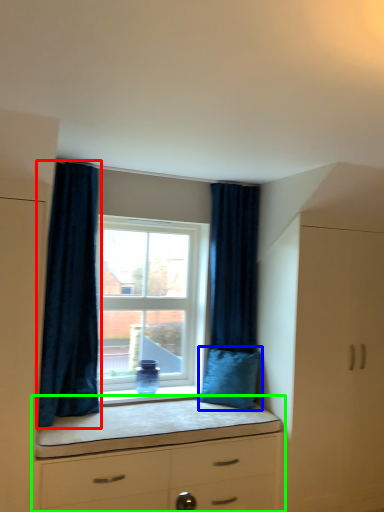
Question: Considering the real-world distances, which object is closest to curtain (highlighted by a red box)? pillow (highlighted by a blue box) or chest of drawers (highlighted by a green box).

Choices:
 (A) pillow
 (B) chest of drawers

Answer: (B)